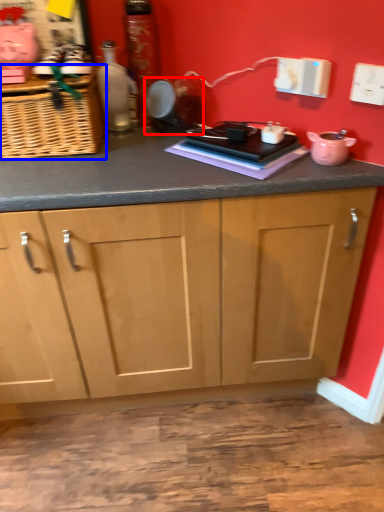
Question: Which object appears farthest to the camera in this image, appliance (highlighted by a red box) or basket (highlighted by a blue box)?

Choices:
 (A) appliance
 (B) basket

Answer: (A)